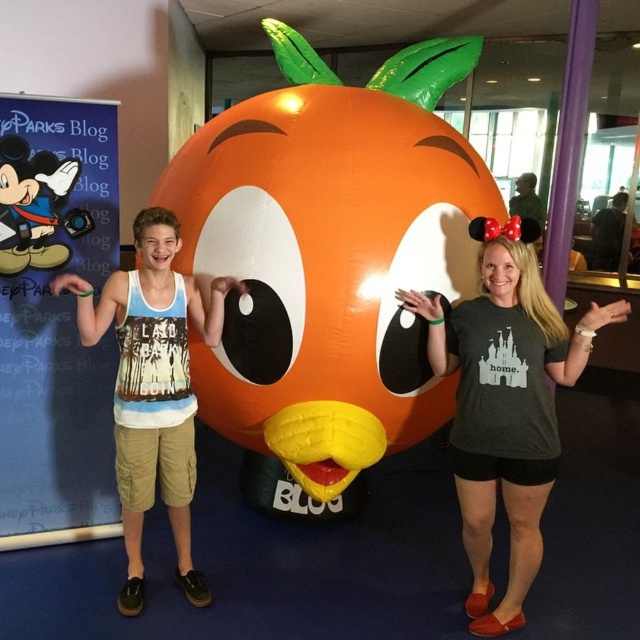
Who is positioned more to the right, dark gray t-shirt at center or white cotton tank top at center?

From the viewer's perspective, dark gray t-shirt at center appears more on the right side.

Is dark gray t-shirt at center thinner than white cotton tank top at center?

No.

Does point (536, 496) lie behind point (122, 378)?

No, (536, 496) is in front of (122, 378).

Locate an element on the screen. dark gray t-shirt at center is located at coordinates (506, 403).

This screenshot has width=640, height=640. I want to click on brushed metal mickey mouse poster at left, so click(x=54, y=320).

This screenshot has width=640, height=640. Find the location of `brushed metal mickey mouse poster at left`. brushed metal mickey mouse poster at left is located at coordinates (54, 320).

This screenshot has height=640, width=640. Identify the location of brushed metal mickey mouse poster at left. (54, 320).

Is point (456, 189) positioned before point (156, 230)?

No, (456, 189) is behind (156, 230).

Does inflatable orange at center have a greater height compared to white cotton tank top at center?

Yes, inflatable orange at center is taller than white cotton tank top at center.

Who is more forward, (204,275) or (184,385)?

Point (184,385) is more forward.

At what (x,y) coordinates should I click in order to perform the action: click on inflatable orange at center. Please return your answer as a coordinate pair (x, y). This screenshot has height=640, width=640. Looking at the image, I should click on (330, 253).